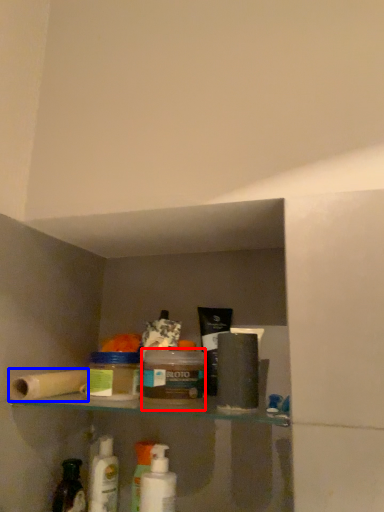
Question: Which object appears farthest to the camera in this image, product (highlighted by a red box) or toilet paper (highlighted by a blue box)?

Choices:
 (A) product
 (B) toilet paper

Answer: (B)